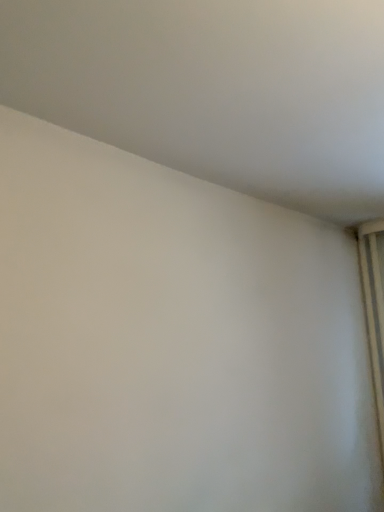
I want to click on white striped curtain at right, so click(373, 311).

Describe the element at coordinates (373, 311) in the screenshot. I see `white striped curtain at right` at that location.

The width and height of the screenshot is (384, 512). In order to click on white striped curtain at right in this screenshot , I will do `click(373, 311)`.